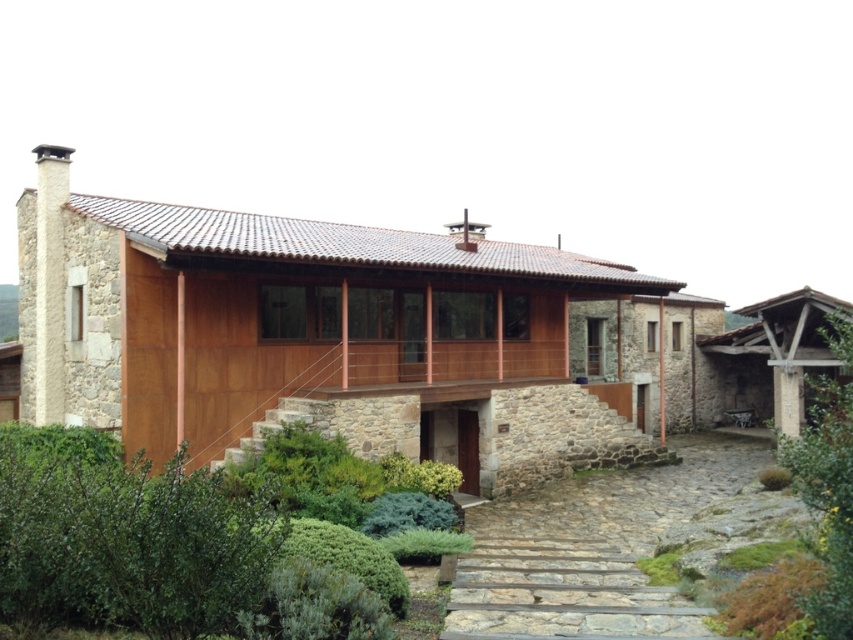
You are a gardener planning to trim the green leafy hedge at center and the gray stone steps at center. Which object requires more effort to maintain based on their thickness?

The gray stone steps at center require more effort to maintain because they are thicker than the green leafy hedge at center.

You are standing at the entrance of the house and want to know where the green leafy hedge at center is located. Can you describe its position relative to the entrance?

The green leafy hedge at center is located at point (155, 548) relative to the entrance, which places it slightly to the right and forward from the entrance.

You are standing at the entrance of the house and notice a point marked at coordinates [155,548]. What object is located at this point?

The point at coordinates [155,548] marks the green leafy hedge at center.